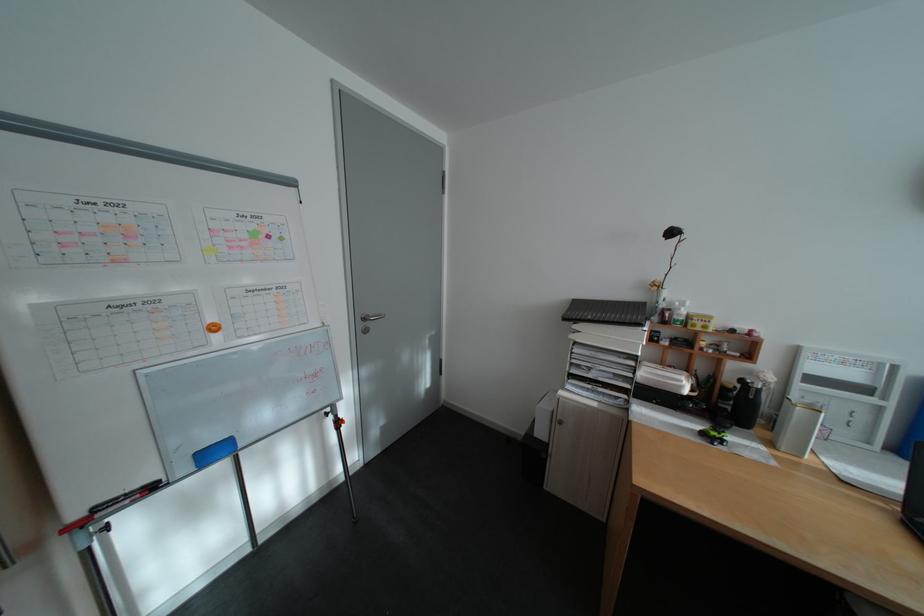
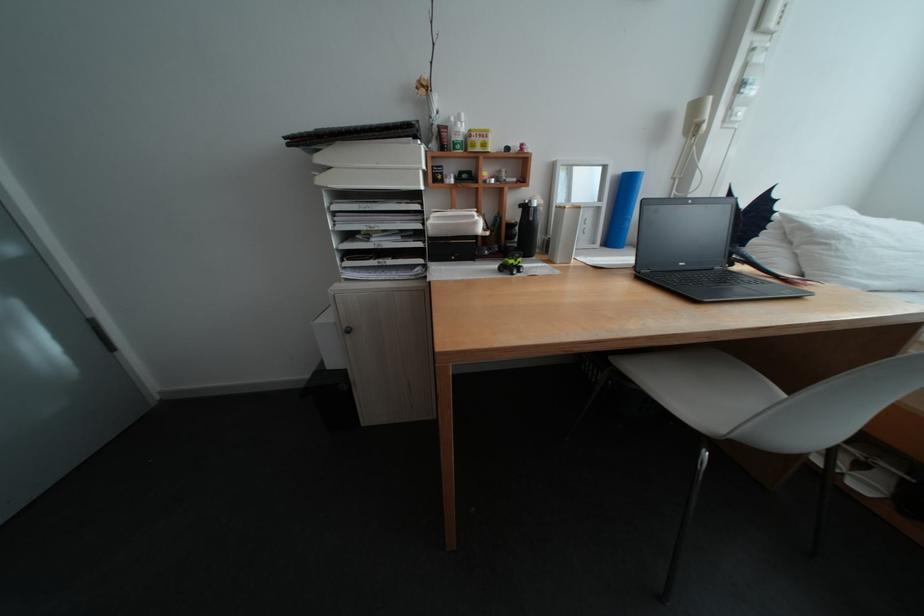
The point at [676,310] is marked in the first image. Where is the corresponding point in the second image?

(453, 128)